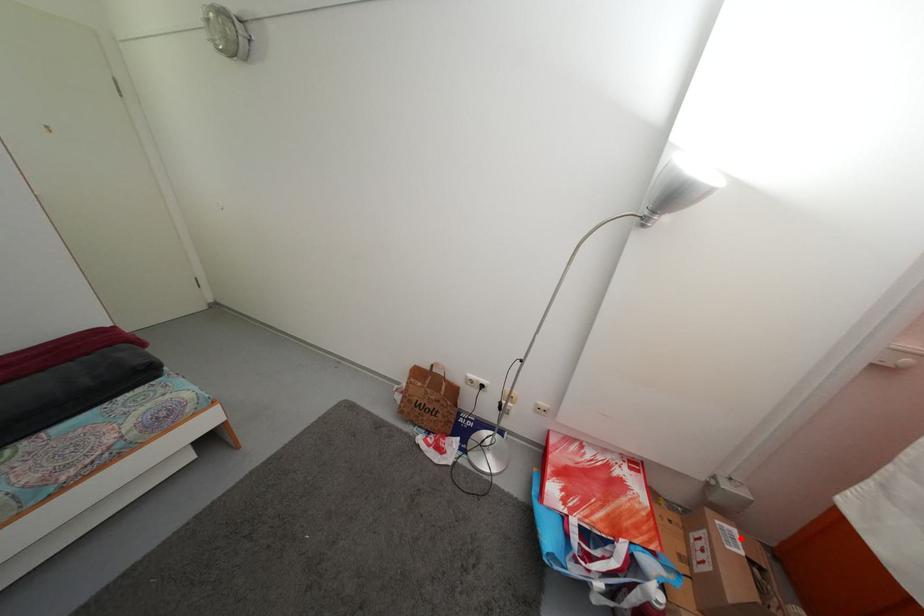
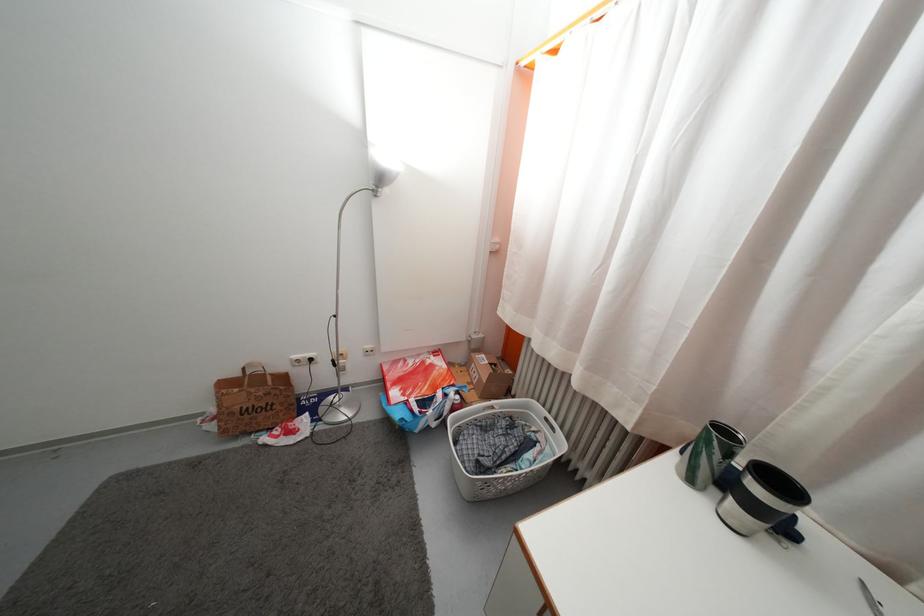
Question: I am providing you with two images of the same scene from different viewpoints. In image1, a red point is highlighted. Considering the same 3D point in image2, which of the following is correct?

Choices:
 (A) It is closer
 (B) It is farther

Answer: (B)